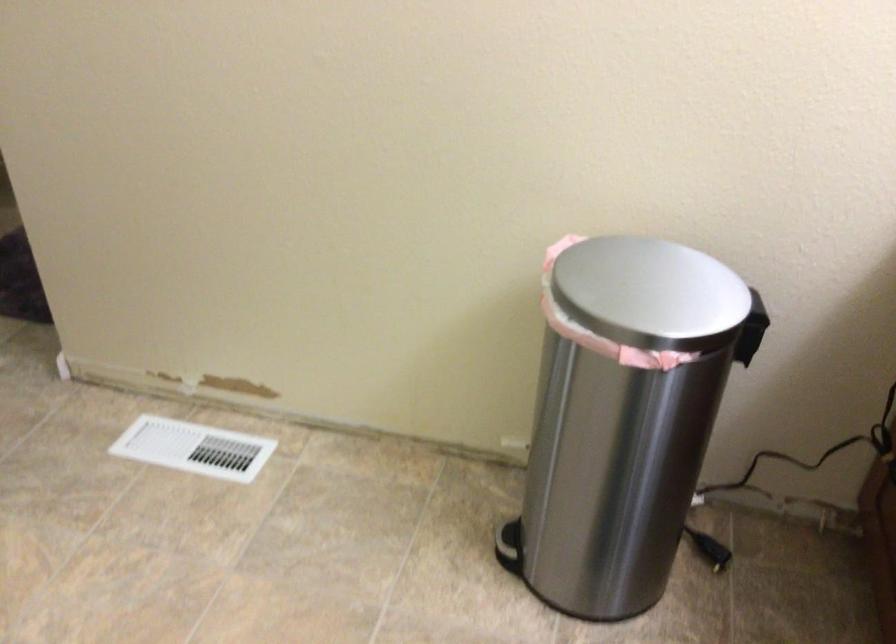
The width and height of the screenshot is (896, 644). What do you see at coordinates (794, 483) in the screenshot?
I see `the black electrical plug` at bounding box center [794, 483].